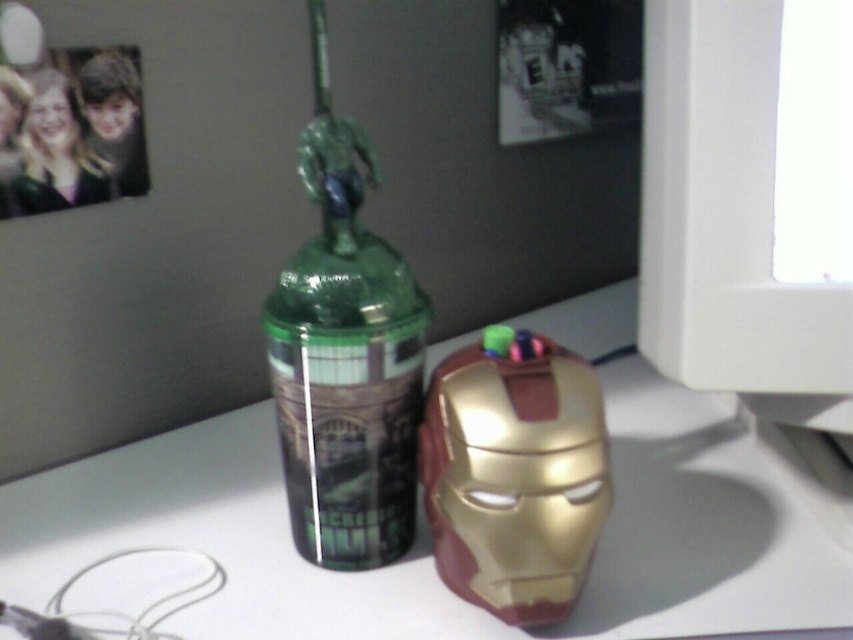
Which is behind, point (373, 545) or point (479, 385)?

The point (373, 545) is more distant.

Image resolution: width=853 pixels, height=640 pixels. What do you see at coordinates (345, 356) in the screenshot? I see `green glossy bottle at center` at bounding box center [345, 356].

Locate an element on the screen. This screenshot has height=640, width=853. green glossy bottle at center is located at coordinates tap(345, 356).

Who is taller, white glossy table at center or green glossy bottle at center?

Standing taller between the two is green glossy bottle at center.

Can you confirm if white glossy table at center is thinner than green glossy bottle at center?

No.

What do you see at coordinates (428, 536) in the screenshot?
I see `white glossy table at center` at bounding box center [428, 536].

Find the location of `white glossy table at center`. white glossy table at center is located at coordinates (428, 536).

Who is positioned more to the left, white glossy table at center or gold metallic iron man mask at center?

From the viewer's perspective, gold metallic iron man mask at center appears more on the left side.

In the scene shown: Does white glossy table at center appear on the left side of gold metallic iron man mask at center?

Incorrect, white glossy table at center is not on the left side of gold metallic iron man mask at center.

Is point (131, 522) positioned behind point (494, 454)?

Yes, point (131, 522) is farther from viewer.

Where is `white glossy table at center`? The height and width of the screenshot is (640, 853). white glossy table at center is located at coordinates (428, 536).